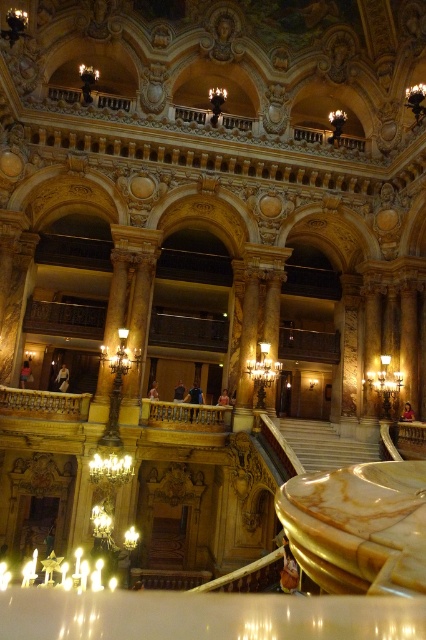
You are an event planner setting up a walkway for a gala. The walkway must be wide enough to allow two people to walk side by side comfortably. You have the white marble stairs at center and the gold ornate railing at upper center available. Which of these two would you choose for the walkway?

The gold ornate railing at upper center has a greater width than the white marble stairs at center, so it would be suitable for the walkway requiring enough space for two people to walk side by side.

You are an architect inspecting the theater. You need to determine the spatial relationship between the white marble stairs at center and the gold ornate railing at upper center. Which object is positioned to the right of the other?

The white marble stairs at center is positioned to the right of the gold ornate railing at upper center according to the description.

You are standing in the grand theater and want to move from the point at coordinates point (285,426) to the point at coordinates point (97,99). Which direction should you move to get closer to your destination?

To move from point (285,426) to point (97,99), you should move towards the left and downward since point (285,426) is in front of point (97,99).